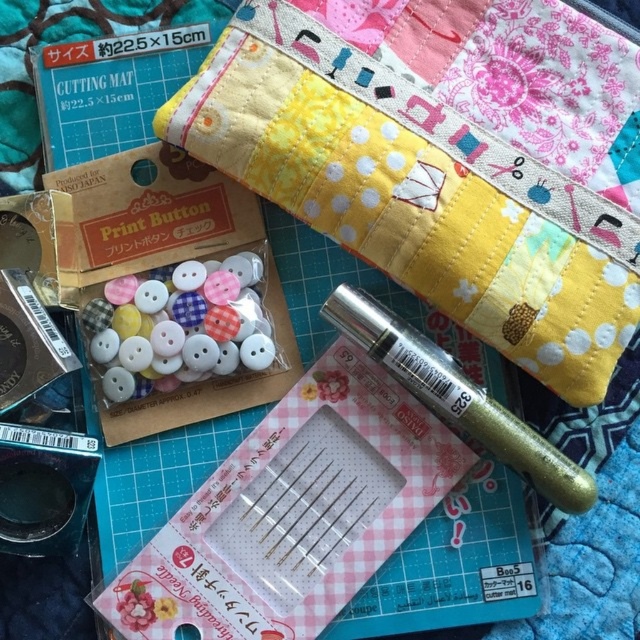
Is gold glitter pen at upper center taller than gold glitter pen at center?

Yes, gold glitter pen at upper center is taller than gold glitter pen at center.

Is point (358, 54) closer to viewer compared to point (381, 348)?

No, it is not.

Is point (336, 134) in front of point (506, 420)?

No, it is not.

Find the location of `gold glitter pen at upper center`. gold glitter pen at upper center is located at coordinates (417, 193).